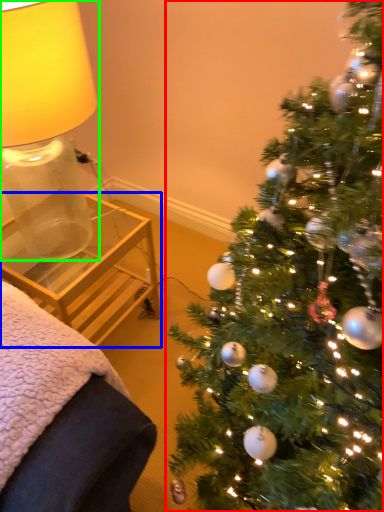
Question: Based on their relative distances, which object is farther from christmas tree (highlighted by a red box)? Choose from table (highlighted by a blue box) and table lamp (highlighted by a green box).

Choices:
 (A) table
 (B) table lamp

Answer: (B)